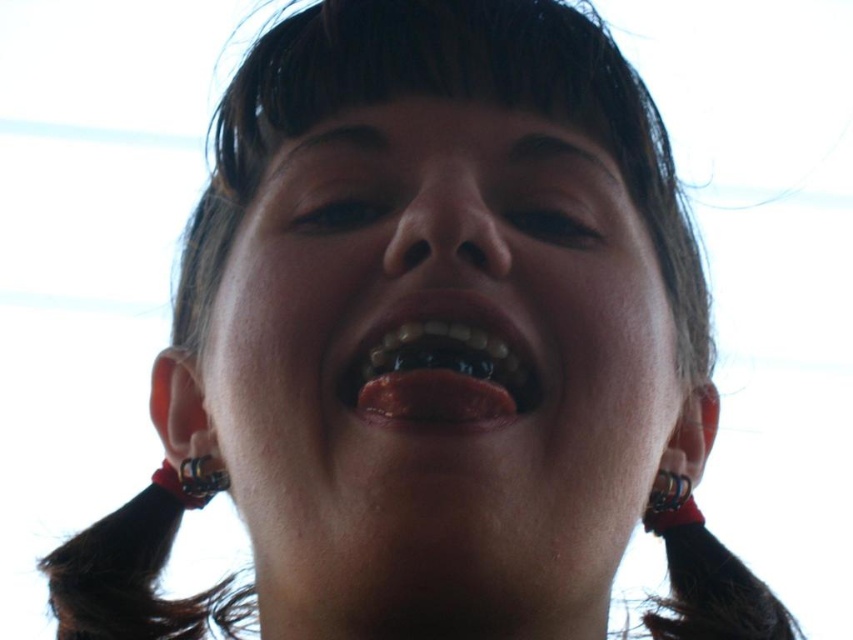
In the image, you see a person with a smooth skin face at center and a silver metallic ring at lower left. Which object takes up more space horizontally?

The smooth skin face at center takes up more space horizontally because its width is larger than the silver metallic ring at lower left.

You are a photographer trying to adjust the focus of your camera to capture the shiny white teeth at center. What are the coordinates where you should focus the camera?

The coordinates where you should focus the camera are at point (440, 372), as the shiny white teeth at center are located there.